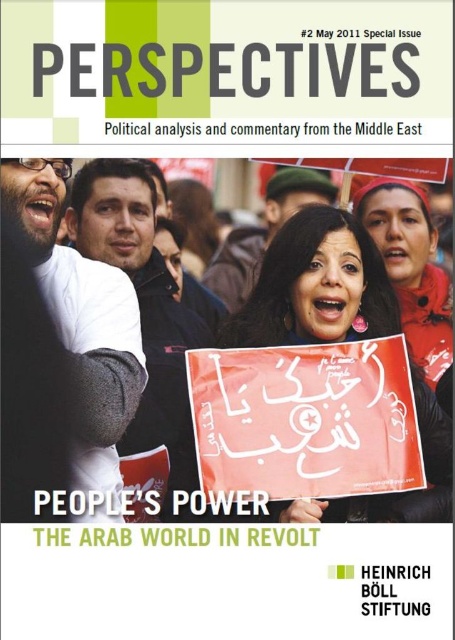
Between red matte sign at center and matte red scarf at upper right, which one has less height?

matte red scarf at upper right

This screenshot has width=455, height=640. Describe the element at coordinates (317, 285) in the screenshot. I see `red matte sign at center` at that location.

This screenshot has width=455, height=640. What are the coordinates of `red matte sign at center` in the screenshot? It's located at (317, 285).